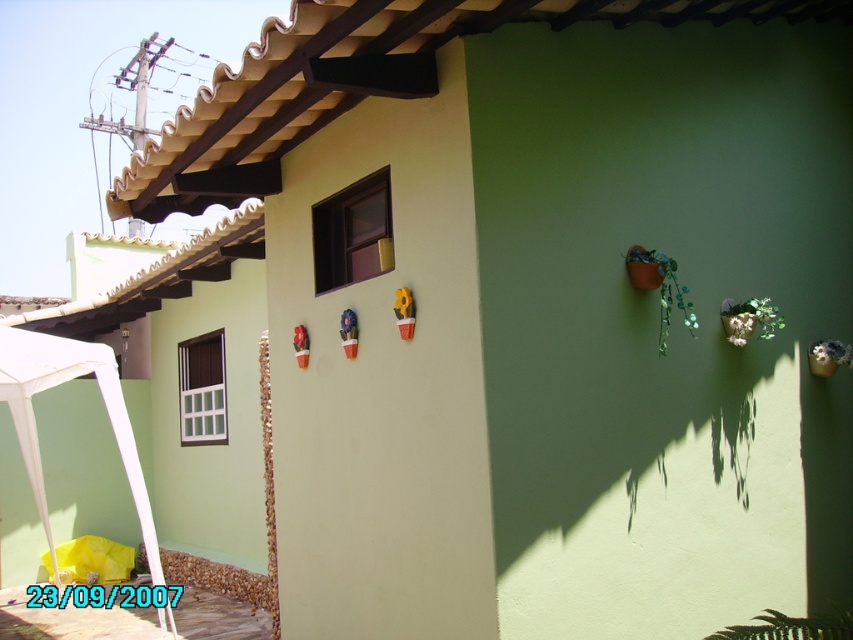
You are standing at the base of the building looking up at the wall. There are two points marked on the wall. The first point is at coordinates point (639, 273) and the second is at point (730, 340). Which point is closer to you?

Point (639, 273) is in front of point (730, 340), so it is closer to you.

You are a maintenance worker inspecting the building. You notice the green matte plant at upper right and the green leafy plant at lower right. Which one is closer to you from your vantage point?

The green leafy plant at lower right is behind the green matte plant at upper right, so the green matte plant at upper right is closer to you.

You are standing at the base of the building shown in the image. You want to water the green matte plant at upper right, but your watering can only reaches up to 5 meters. Can you water it from where you are standing?

The green matte plant at upper right is 5.17 meters away from the viewer, which is beyond the watering can reach of 5 meters. You cannot water it from where you are standing.